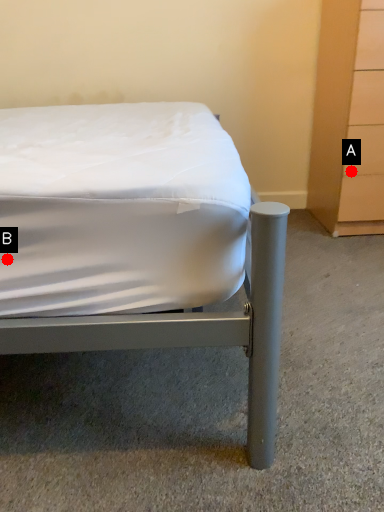
Question: Two points are circled on the image, labeled by A and B beside each circle. Which point appears farthest from the camera in this image?

Choices:
 (A) A is further
 (B) B is further

Answer: (A)